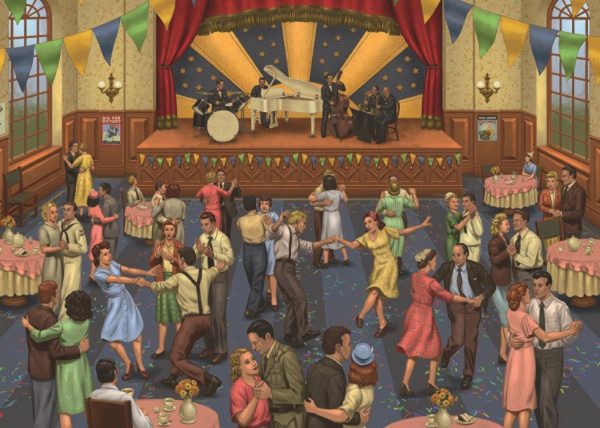
Image resolution: width=600 pixels, height=428 pixels. In order to click on red curtains in this screenshot , I will do `click(171, 43)`, `click(439, 47)`, `click(367, 5)`, `click(241, 4)`.